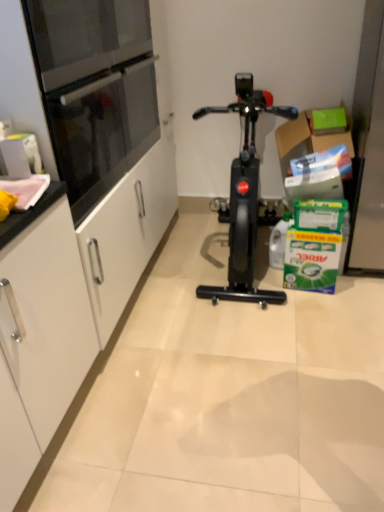
Image resolution: width=384 pixels, height=512 pixels. What do you see at coordinates (245, 197) in the screenshot?
I see `black matte stationary bicycle at center` at bounding box center [245, 197].

What is the approximate height of black matte stationary bicycle at center?

It is 3.76 feet.

Find the location of `black matte stationary bicycle at center`. black matte stationary bicycle at center is located at coordinates (245, 197).

Where is `black matte stationary bicycle at center`? black matte stationary bicycle at center is located at coordinates tap(245, 197).